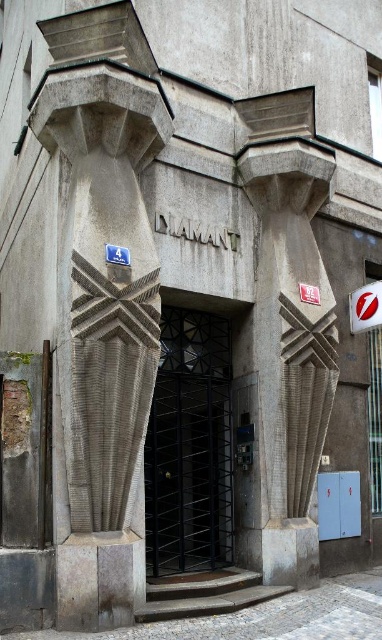
Is gray stone column at center above black metal gate at center?

Actually, gray stone column at center is below black metal gate at center.

What are the coordinates of `gray stone column at center` in the screenshot? It's located at point(291,349).

The width and height of the screenshot is (382, 640). In order to click on gray stone column at center in this screenshot , I will do `click(291, 349)`.

Is gray stone column at center below white plastic sign at upper right?

Yes, gray stone column at center is below white plastic sign at upper right.

Measure the distance between point (299, 268) and camera.

Point (299, 268) and camera are 42.71 feet apart.

Where is `gray stone column at center`? The image size is (382, 640). gray stone column at center is located at coordinates (291, 349).

Is point (123, 448) positioned behind point (365, 326)?

That is False.

Which is in front, point (118, 316) or point (364, 324)?

Point (118, 316) is more forward.

Where is `gray textured column at left`? The width and height of the screenshot is (382, 640). gray textured column at left is located at coordinates (103, 330).